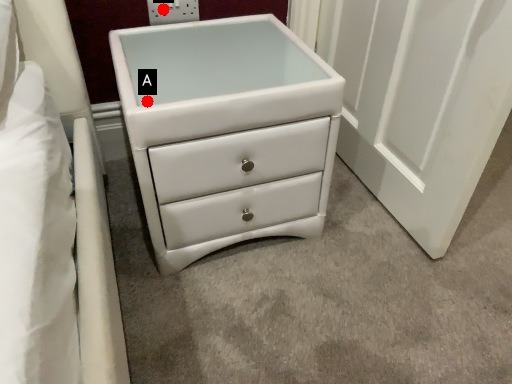
Question: Two points are circled on the image, labeled by A and B beside each circle. Which of the following is the closest to the observer?

Choices:
 (A) A is closer
 (B) B is closer

Answer: (A)